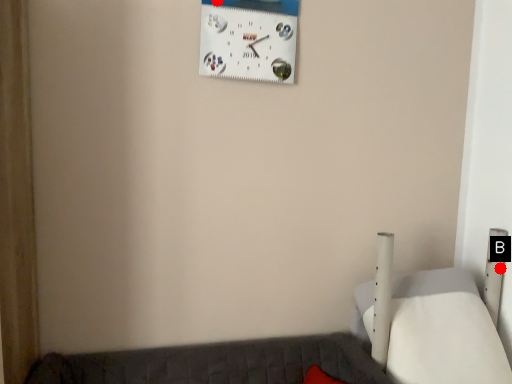
Question: Two points are circled on the image, labeled by A and B beside each circle. Which point is closer to the camera?

Choices:
 (A) A is closer
 (B) B is closer

Answer: (A)